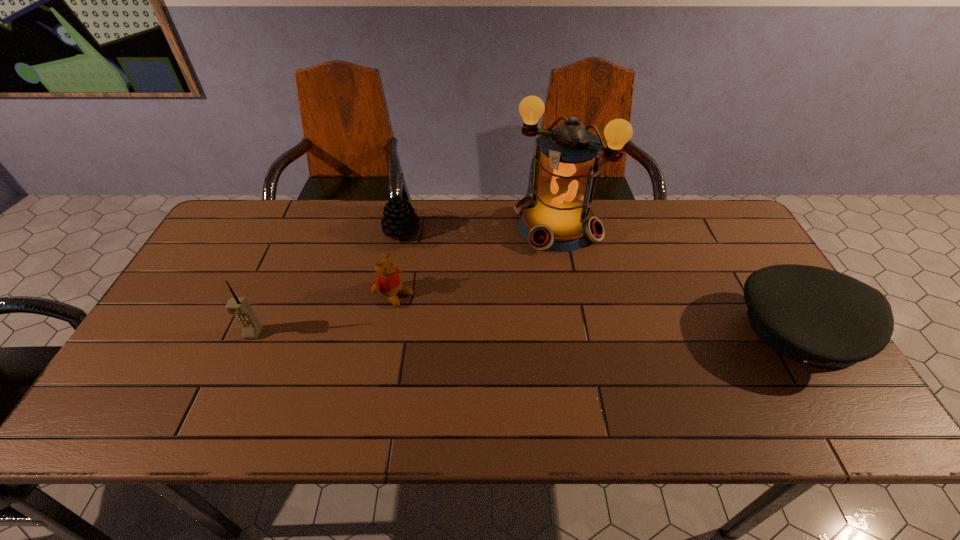
Locate an element on the screen. object present at the right edge is located at coordinates (816, 316).

Where is `object located in the near right corner section of the desktop`? Image resolution: width=960 pixels, height=540 pixels. object located in the near right corner section of the desktop is located at coordinates (816, 316).

You are a GUI agent. You are given a task and a screenshot of the screen. Output one action in this format:
    pyautogui.click(x=<x>, y=<y>)
    Task: Click on the free location at the far edge
    The height and width of the screenshot is (540, 960).
    Given the screenshot: What is the action you would take?
    point(419,217)

The width and height of the screenshot is (960, 540). In the image, there is a desktop. Identify the location of vacant region at the near edge. (691, 389).

Find the location of a particular element. vacant space that is in between the pinecone and the teddy bear is located at coordinates (398, 262).

The width and height of the screenshot is (960, 540). I want to click on vacant space that's between the tallest object and the cellular telephone, so click(405, 280).

The width and height of the screenshot is (960, 540). I want to click on free space that is in between the lantern and the pinecone, so click(x=479, y=228).

The height and width of the screenshot is (540, 960). What are the coordinates of `free point between the second object from right to left and the pinecone` in the screenshot? It's located at (479, 228).

At what (x,y) coordinates should I click in order to perform the action: click on vacant space that is in between the pinecone and the second object from right to left. Please return your answer as a coordinate pair (x, y). Looking at the image, I should click on (479, 228).

The width and height of the screenshot is (960, 540). What are the coordinates of `vacant area that lies between the beret and the lantern` in the screenshot? It's located at (676, 280).